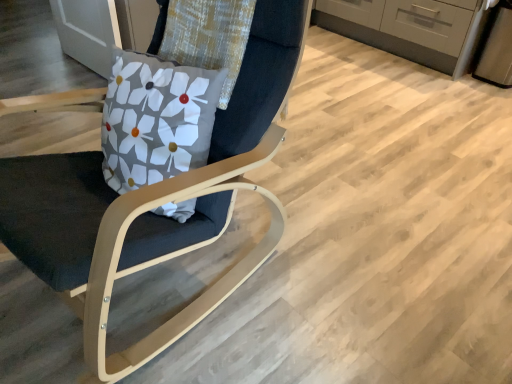
Identify the location of matte wood chair at center. This screenshot has height=384, width=512. (160, 202).

Image resolution: width=512 pixels, height=384 pixels. Describe the element at coordinates (160, 202) in the screenshot. I see `matte wood chair at center` at that location.

What do you see at coordinates (411, 28) in the screenshot? This screenshot has height=384, width=512. I see `matte gray cabinetry at upper right` at bounding box center [411, 28].

Identify the location of matte gray cabinetry at upper right. (411, 28).

Find the location of `matte wood chair at center`. matte wood chair at center is located at coordinates (160, 202).

Considering the relative positions of matte gray cabinetry at upper right and matte wood chair at center in the image provided, is matte gray cabinetry at upper right to the right of matte wood chair at center from the viewer's perspective?

Correct, you'll find matte gray cabinetry at upper right to the right of matte wood chair at center.

Between matte gray cabinetry at upper right and matte wood chair at center, which one is positioned behind?

matte gray cabinetry at upper right.

Considering the points (426, 29) and (86, 221), which point is behind, point (426, 29) or point (86, 221)?

Point (426, 29)

From the image's perspective, is matte gray cabinetry at upper right located above or below matte wood chair at center?

matte gray cabinetry at upper right is above matte wood chair at center.

From a real-world perspective, which is physically below, matte gray cabinetry at upper right or matte wood chair at center?

matte gray cabinetry at upper right.

Does matte gray cabinetry at upper right have a greater width compared to matte wood chair at center?

In fact, matte gray cabinetry at upper right might be narrower than matte wood chair at center.

Considering the sizes of objects matte gray cabinetry at upper right and matte wood chair at center in the image provided, who is shorter, matte gray cabinetry at upper right or matte wood chair at center?

matte gray cabinetry at upper right.

Is matte gray cabinetry at upper right bigger or smaller than matte wood chair at center?

matte gray cabinetry at upper right is bigger than matte wood chair at center.

Is matte gray cabinetry at upper right not inside matte wood chair at center?

Yes.

Would you consider matte gray cabinetry at upper right to be distant from matte wood chair at center?

Yes, matte gray cabinetry at upper right is far from matte wood chair at center.

Looking at this image, is matte gray cabinetry at upper right turned away from matte wood chair at center?

No, matte gray cabinetry at upper right is not facing the opposite direction of matte wood chair at center.

The height and width of the screenshot is (384, 512). What are the coordinates of `chair in front of the matte gray cabinetry at upper right` in the screenshot? It's located at (160, 202).

Considering the relative positions of matte wood chair at center and matte gray cabinetry at upper right in the image provided, is matte wood chair at center to the left or to the right of matte gray cabinetry at upper right?

matte wood chair at center is positioned on matte gray cabinetry at upper right's left side.

Is matte wood chair at center in front of or behind matte gray cabinetry at upper right in the image?

Visually, matte wood chair at center is located in front of matte gray cabinetry at upper right.

Which point is more forward, (193, 221) or (472, 50)?

The point (193, 221) is closer to the camera.

From the image's perspective, relative to matte gray cabinetry at upper right, is matte wood chair at center above or below?

matte wood chair at center is below matte gray cabinetry at upper right.

From a real-world perspective, is matte wood chair at center beneath matte gray cabinetry at upper right?

No.

Between matte wood chair at center and matte gray cabinetry at upper right, which one has larger width?

Wider between the two is matte wood chair at center.

Is matte wood chair at center shorter than matte gray cabinetry at upper right?

Incorrect, the height of matte wood chair at center does not fall short of that of matte gray cabinetry at upper right.

Between matte wood chair at center and matte gray cabinetry at upper right, which one has larger size?

matte gray cabinetry at upper right is bigger.

Is matte gray cabinetry at upper right inside matte wood chair at center?

No, matte gray cabinetry at upper right is not inside matte wood chair at center.

Can you see matte wood chair at center touching matte gray cabinetry at upper right?

They are not placed beside each other.

Is matte wood chair at center facing away from matte gray cabinetry at upper right?

Yes, matte wood chair at center's orientation is away from matte gray cabinetry at upper right.

Can you tell me how much matte wood chair at center and matte gray cabinetry at upper right differ in facing direction?

There is a 6.38-degree angle between the facing directions of matte wood chair at center and matte gray cabinetry at upper right.

Locate an element on the screen. The image size is (512, 384). chair that is below the matte gray cabinetry at upper right (from the image's perspective) is located at coordinates pyautogui.click(x=160, y=202).

In the image, there is a matte gray cabinetry at upper right. Where is `chair below it (from the image's perspective)`? The image size is (512, 384). chair below it (from the image's perspective) is located at coordinates (160, 202).

Locate an element on the screen. cabinetry on the right of matte wood chair at center is located at coordinates (411, 28).